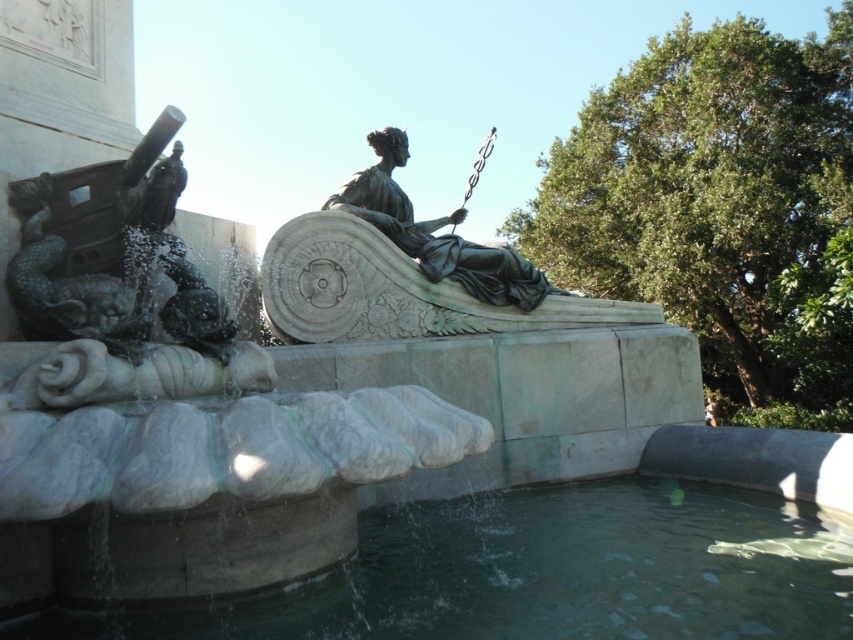
Between clear water at lower center and polished bronze cannon at left, which one has more height?

Standing taller between the two is polished bronze cannon at left.

Does point (619, 621) lie in front of point (67, 240)?

That is True.

Where is `clear water at lower center`? clear water at lower center is located at coordinates (541, 573).

Can you confirm if clear water at lower center is thinner than bronze statue at center?

No, clear water at lower center is not thinner than bronze statue at center.

What are the coordinates of `clear water at lower center` in the screenshot? It's located at (541, 573).

Does polished bronze cannon at left come behind bronze statue at center?

No, polished bronze cannon at left is in front of bronze statue at center.

Is point (184, 317) positioned after point (405, 250)?

No, it is not.

Locate an element on the screen. Image resolution: width=853 pixels, height=640 pixels. polished bronze cannon at left is located at coordinates (112, 253).